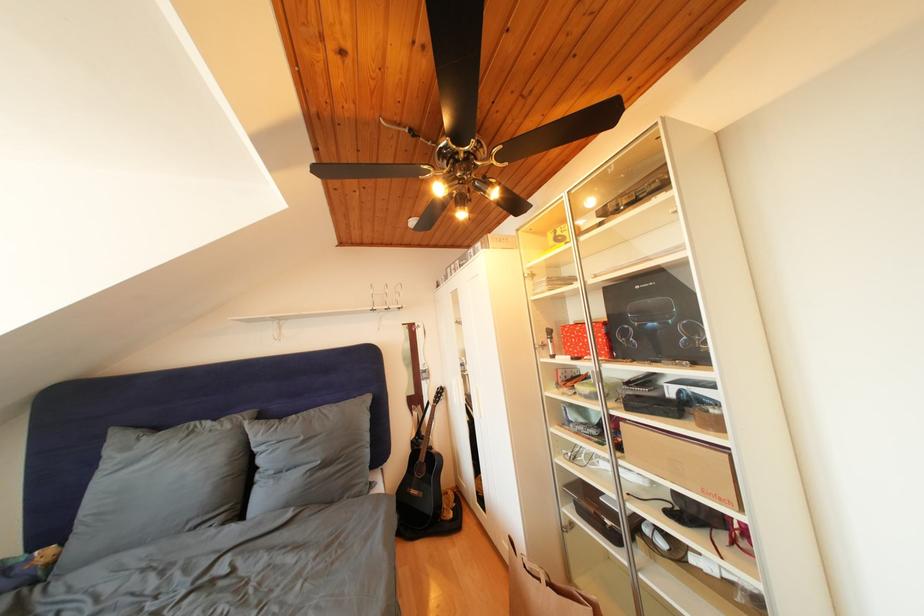
You are a GUI agent. You are given a task and a screenshot of the screen. Output one action in this format:
    pyautogui.click(x=<x>, y=<y>)
    Task: Click on the red patterned box
    The image size is (924, 616).
    Given the screenshot: What is the action you would take?
    (x=585, y=339)